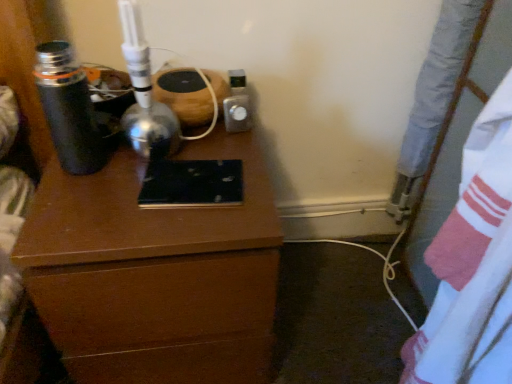
Find the location of `free space above brown wood chest of drawers at center (from a real-world perspective)`. free space above brown wood chest of drawers at center (from a real-world perspective) is located at coordinates (163, 169).